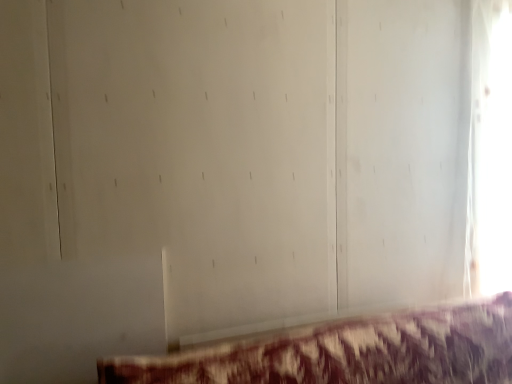
Question: Does maroon fabric couch at lower center have a lesser width compared to transparent glass window at right?

Choices:
 (A) yes
 (B) no

Answer: (B)

Question: From a real-world perspective, is maroon fabric couch at lower center located beneath transparent glass window at right?

Choices:
 (A) no
 (B) yes

Answer: (B)

Question: Is maroon fabric couch at lower center taller than transparent glass window at right?

Choices:
 (A) yes
 (B) no

Answer: (B)

Question: Can you confirm if maroon fabric couch at lower center is bigger than transparent glass window at right?

Choices:
 (A) yes
 (B) no

Answer: (A)

Question: Does maroon fabric couch at lower center lie behind transparent glass window at right?

Choices:
 (A) yes
 (B) no

Answer: (B)

Question: From the image's perspective, does maroon fabric couch at lower center appear lower than transparent glass window at right?

Choices:
 (A) no
 (B) yes

Answer: (B)

Question: Is transparent glass window at right to the right of maroon fabric couch at lower center from the viewer's perspective?

Choices:
 (A) no
 (B) yes

Answer: (B)

Question: From the image's perspective, is transparent glass window at right located above maroon fabric couch at lower center?

Choices:
 (A) no
 (B) yes

Answer: (B)

Question: Does transparent glass window at right have a smaller size compared to maroon fabric couch at lower center?

Choices:
 (A) no
 (B) yes

Answer: (B)

Question: Does transparent glass window at right have a larger size compared to maroon fabric couch at lower center?

Choices:
 (A) yes
 (B) no

Answer: (B)

Question: Is transparent glass window at right oriented towards maroon fabric couch at lower center?

Choices:
 (A) no
 (B) yes

Answer: (A)

Question: Is transparent glass window at right taller than maroon fabric couch at lower center?

Choices:
 (A) no
 (B) yes

Answer: (B)

Question: In terms of height, does maroon fabric couch at lower center look taller or shorter compared to transparent glass window at right?

Choices:
 (A) tall
 (B) short

Answer: (B)